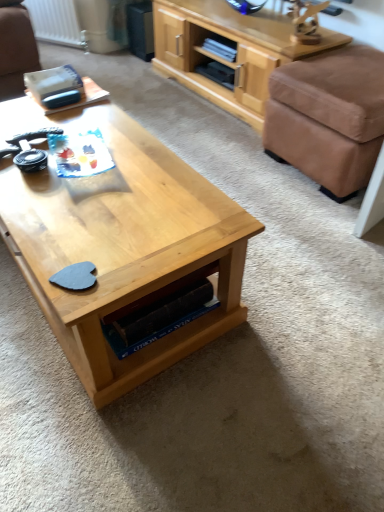
Question: Is brown fabric ottoman at right situated inside light wood cabinet at upper right or outside?

Choices:
 (A) outside
 (B) inside

Answer: (A)

Question: Considering their positions, is brown fabric ottoman at right located in front of or behind light wood cabinet at upper right?

Choices:
 (A) behind
 (B) front

Answer: (B)

Question: Which of these objects is positioned farthest from the light wood coffee table at center?

Choices:
 (A) light wood cabinet at upper right
 (B) brown fabric ottoman at right
 (C) white painted metal radiator at upper left

Answer: (C)

Question: Which is farther from the white painted metal radiator at upper left?

Choices:
 (A) light wood coffee table at center
 (B) light wood cabinet at upper right
 (C) brown fabric ottoman at right

Answer: (A)